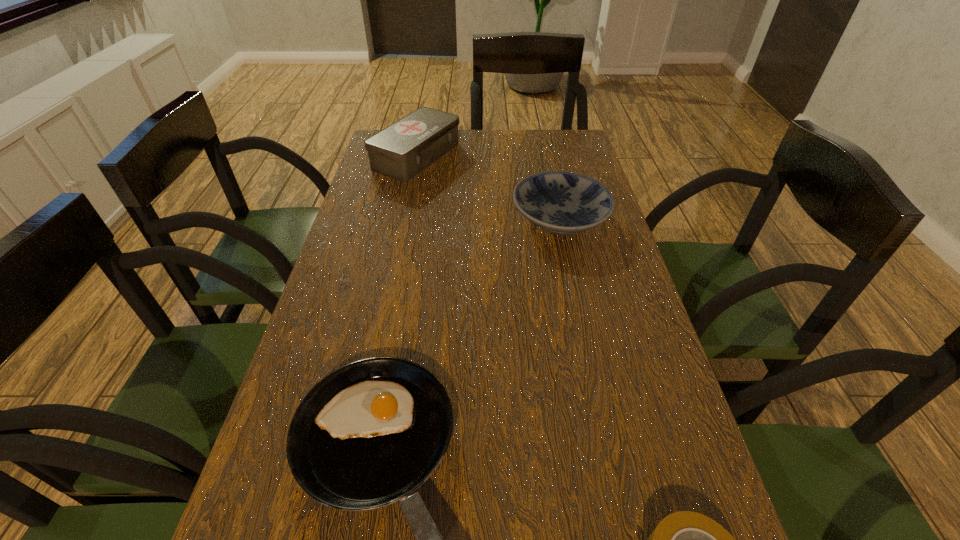
The image size is (960, 540). I want to click on free space at the far edge of the desktop, so click(461, 150).

Locate an element on the screen. vacant region at the left edge is located at coordinates (372, 274).

Find the location of a particular element. free space at the right edge is located at coordinates (659, 399).

Identify the location of free space between the tallest object and the plate. (489, 187).

Identify the location of free spot between the plate and the first-aid kit. The image size is (960, 540). (489, 187).

Identify which object is the second nearest to the tallest object. Please provide its 2D coordinates. Your answer should be formatted as a tuple, i.e. [(x, y)], where the tuple contains the x and y coordinates of a point satisfying the conditions above.

[(370, 433)]

Point out which object is positioned as the second nearest to the tallest object. Please provide its 2D coordinates. Your answer should be formatted as a tuple, i.e. [(x, y)], where the tuple contains the x and y coordinates of a point satisfying the conditions above.

[(370, 433)]